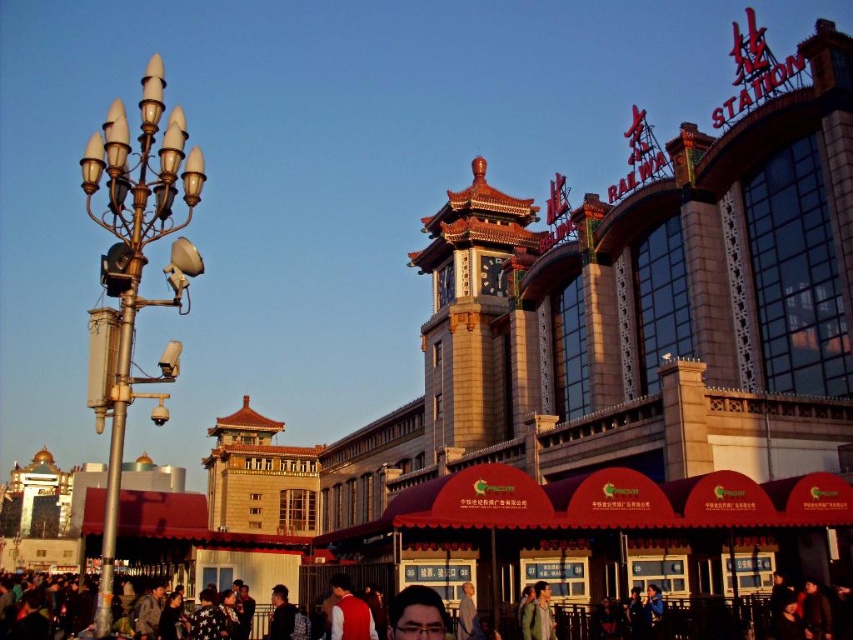
You are standing at the Beijing Railway Station and want to find the shortest path from point A to point B. The coordinates for point A are point A at (80, 177) and point B are point B at (733, 634). Considering the layout of the station, which direction should you head from point A to reach point B most efficiently?

Since point A at (80, 177) is behind point B at (733, 634), you should move forward towards point B at (733, 634) to reach it most efficiently.